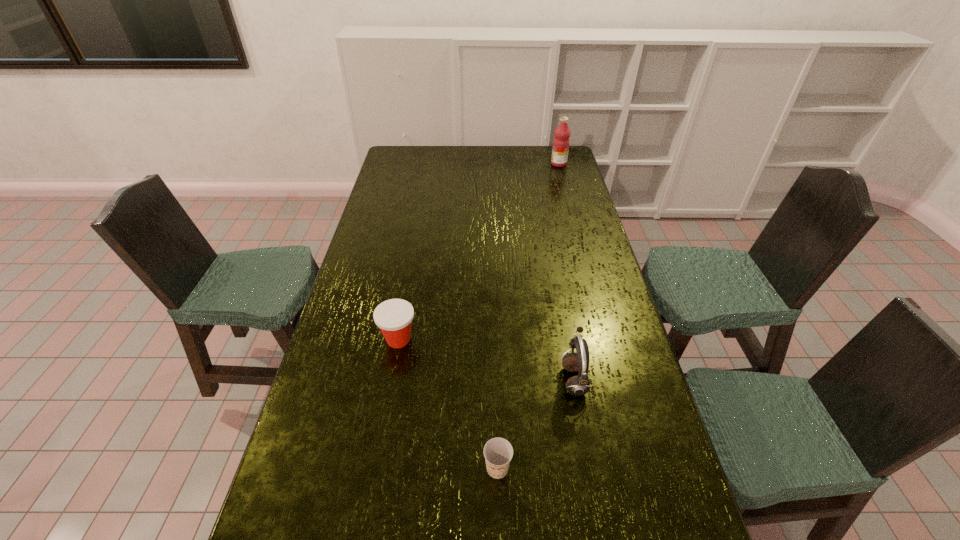
The width and height of the screenshot is (960, 540). Find the location of `free space between the second object from right to left and the taller Dixie cup`. free space between the second object from right to left and the taller Dixie cup is located at coordinates (486, 360).

Locate an element on the screen. This screenshot has height=540, width=960. free space between the farthest object and the taller Dixie cup is located at coordinates (479, 252).

Locate an element on the screen. free point between the earphone and the tallest object is located at coordinates (566, 272).

The height and width of the screenshot is (540, 960). Find the location of `object identified as the second closest to the right Dixie cup`. object identified as the second closest to the right Dixie cup is located at coordinates (394, 317).

Locate an element on the screen. The height and width of the screenshot is (540, 960). the third closest object relative to the fruit juice is located at coordinates pos(498,452).

Image resolution: width=960 pixels, height=540 pixels. In order to click on free spot that satisfies the following two spatial constraints: 1. on the label of the tallest object; 2. on the front side of the third nearest object in this screenshot , I will do `click(608, 340)`.